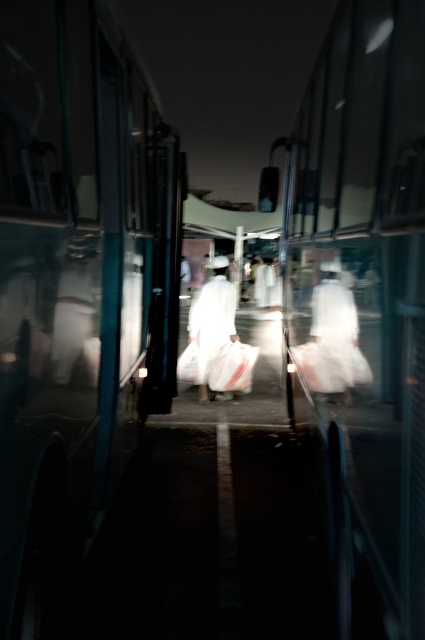
Based on the photo, does white matte robe at center appear on the right side of white cotton robe at center?

Correct, you'll find white matte robe at center to the right of white cotton robe at center.

The image size is (425, 640). What do you see at coordinates (337, 330) in the screenshot? I see `white matte robe at center` at bounding box center [337, 330].

The image size is (425, 640). I want to click on white matte robe at center, so click(x=337, y=330).

Is shiny metallic bus at center below white cotton robe at center?

Actually, shiny metallic bus at center is above white cotton robe at center.

Is shiny metallic bus at center taller than white cotton robe at center?

Yes.

Where is `shiny metallic bus at center`? The width and height of the screenshot is (425, 640). shiny metallic bus at center is located at coordinates (362, 305).

Is metallic silver bus at center below shiny metallic bus at center?

Correct, metallic silver bus at center is located below shiny metallic bus at center.

Does metallic silver bus at center appear on the left side of shiny metallic bus at center?

Correct, you'll find metallic silver bus at center to the left of shiny metallic bus at center.

Where is `metallic silver bus at center`? This screenshot has width=425, height=640. metallic silver bus at center is located at coordinates (76, 285).

At what (x,y) coordinates should I click in order to perform the action: click on metallic silver bus at center. Please return your answer as a coordinate pair (x, y). This screenshot has width=425, height=640. Looking at the image, I should click on (76, 285).